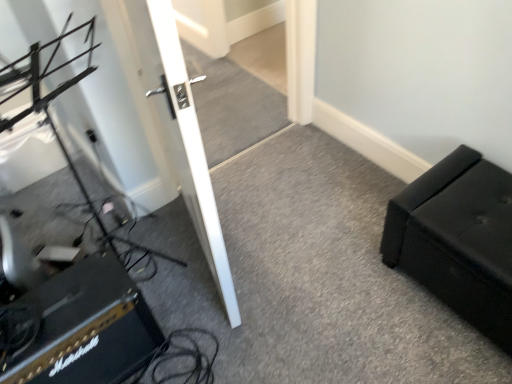
Question: From a real-world perspective, is white glossy door at center positioned above or below black leather ottoman at right?

Choices:
 (A) below
 (B) above

Answer: (B)

Question: In the image, is white glossy door at center positioned in front of or behind black leather ottoman at right?

Choices:
 (A) behind
 (B) front

Answer: (B)

Question: Which object is positioned closest to the black textured amplifier at lower left?

Choices:
 (A) black leather ottoman at right
 (B) white glossy door at center

Answer: (B)

Question: Based on their relative distances, which object is farther from the white glossy door at center?

Choices:
 (A) black textured amplifier at lower left
 (B) black leather ottoman at right

Answer: (B)